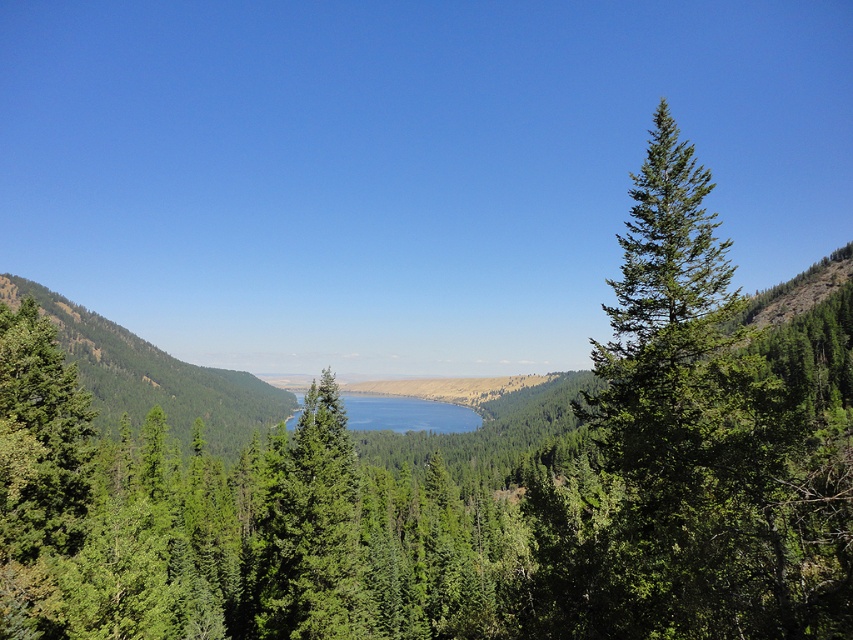
Question: Is green forested mountain at center positioned at the back of blue reflective water at center?

Choices:
 (A) yes
 (B) no

Answer: (B)

Question: In this image, where is green forested mountain at center located relative to blue reflective water at center?

Choices:
 (A) right
 (B) left

Answer: (B)

Question: Which point is farther from the camera taking this photo?

Choices:
 (A) (114, 401)
 (B) (413, 401)

Answer: (B)

Question: Observing the image, what is the correct spatial positioning of green forested mountain at center in reference to blue reflective water at center?

Choices:
 (A) left
 (B) right

Answer: (A)